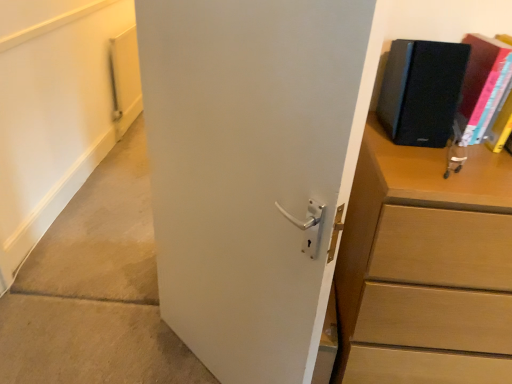
Question: Does white matte door at center contain wooden chest of drawers at right?

Choices:
 (A) no
 (B) yes

Answer: (A)

Question: Is white matte door at center facing towards wooden chest of drawers at right?

Choices:
 (A) no
 (B) yes

Answer: (A)

Question: Is the position of white matte door at center more distant than that of wooden chest of drawers at right?

Choices:
 (A) yes
 (B) no

Answer: (B)

Question: Considering the relative sizes of white matte door at center and wooden chest of drawers at right in the image provided, is white matte door at center shorter than wooden chest of drawers at right?

Choices:
 (A) yes
 (B) no

Answer: (B)

Question: From a real-world perspective, is white matte door at center located beneath wooden chest of drawers at right?

Choices:
 (A) no
 (B) yes

Answer: (A)

Question: In the image, is black matte speaker at upper right, which is the second paperback book from right to left, positioned in front of or behind matte black book at upper right, arranged as the second paperback book when viewed from the left?

Choices:
 (A) behind
 (B) front

Answer: (B)

Question: Considering the positions of black matte speaker at upper right, which is the first paperback book from left to right, and matte black book at upper right, arranged as the 1th paperback book when viewed from the right, in the image, is black matte speaker at upper right, which is the first paperback book from left to right, wider or thinner than matte black book at upper right, arranged as the 1th paperback book when viewed from the right,?

Choices:
 (A) wide
 (B) thin

Answer: (B)

Question: From the image's perspective, is black matte speaker at upper right, which is the second paperback book from right to left, above or below matte black book at upper right, arranged as the second paperback book when viewed from the left?

Choices:
 (A) above
 (B) below

Answer: (A)

Question: Considering the positions of black matte speaker at upper right, which is the second paperback book from right to left, and matte black book at upper right, arranged as the 1th paperback book when viewed from the right, in the image, is black matte speaker at upper right, which is the second paperback book from right to left, bigger or smaller than matte black book at upper right, arranged as the 1th paperback book when viewed from the right,?

Choices:
 (A) big
 (B) small

Answer: (A)

Question: From a real-world perspective, relative to wooden chest of drawers at right, is white matte door at center vertically above or below?

Choices:
 (A) below
 (B) above

Answer: (B)

Question: Considering the positions of point 315,329 and point 394,375, is point 315,329 closer or farther from the camera than point 394,375?

Choices:
 (A) closer
 (B) farther

Answer: (A)

Question: Based on their sizes in the image, would you say white matte door at center is bigger or smaller than wooden chest of drawers at right?

Choices:
 (A) big
 (B) small

Answer: (B)

Question: From their relative heights in the image, would you say white matte door at center is taller or shorter than wooden chest of drawers at right?

Choices:
 (A) tall
 (B) short

Answer: (A)

Question: Considering the positions of wooden chest of drawers at right and matte black book at upper right, arranged as the second paperback book when viewed from the left, in the image, is wooden chest of drawers at right bigger or smaller than matte black book at upper right, arranged as the second paperback book when viewed from the left,?

Choices:
 (A) big
 (B) small

Answer: (A)

Question: Is wooden chest of drawers at right inside or outside of matte black book at upper right, arranged as the 1th paperback book when viewed from the right?

Choices:
 (A) outside
 (B) inside

Answer: (A)